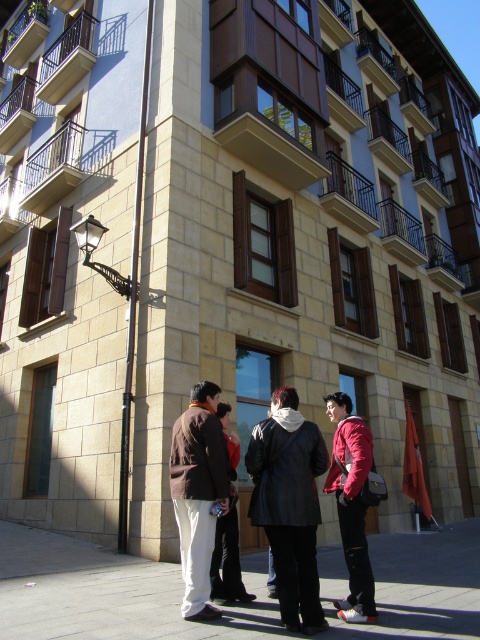
You are a fashion designer observing the group of four individuals on the sidewalk. You notice two jackets at the center of the scene. Which jacket is shorter in height between the leather jacket at center and the matte red jacket at center?

The leather jacket at center is shorter in height than the matte red jacket at center, as it is not as tall.

You are standing at the point marked as point [267,525] in front of the building. You need to walk back to the entrance of the building, which is 5 meters away from your current position. Can you reach the entrance without moving past the point?

The distance between point [267,525] and the viewer is 4.05 meters. Since the entrance is 5 meters away from your current position, you would need to walk an additional 0.95 meters beyond the point to reach it. Therefore, you cannot reach the entrance without moving past the point.

You are one of the people standing on the sidewalk in front of the building. You notice two points marked on the pavement. The first point is at coordinate point(x=252, y=429) and the second is at point(x=232, y=499). If you were to walk from the first point to the second point, would you be moving forward or backward relative to the building?

Since point(x=252, y=429) is behind point(x=232, y=499), walking from the first point to the second point would mean moving forward towards the building.